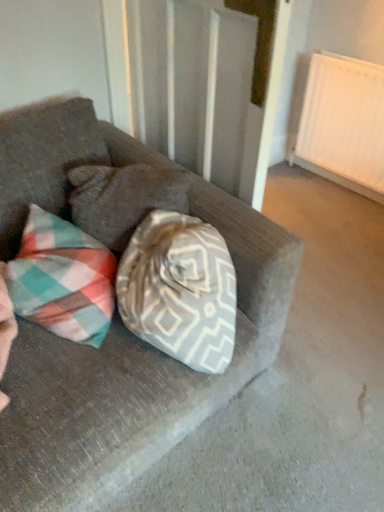
Question: Is suede couch at center bigger than plaid fabric pillow at center?

Choices:
 (A) yes
 (B) no

Answer: (A)

Question: Is suede couch at center not inside plaid fabric pillow at center?

Choices:
 (A) no
 (B) yes

Answer: (B)

Question: Is plaid fabric pillow at center a part of suede couch at center?

Choices:
 (A) yes
 (B) no

Answer: (A)

Question: Does suede couch at center turn towards plaid fabric pillow at center?

Choices:
 (A) yes
 (B) no

Answer: (B)

Question: Can you confirm if suede couch at center is positioned to the right of plaid fabric pillow at center?

Choices:
 (A) yes
 (B) no

Answer: (B)

Question: From the image's perspective, would you say suede couch at center is positioned over plaid fabric pillow at center?

Choices:
 (A) yes
 (B) no

Answer: (B)

Question: Can you confirm if white textured curtain at upper center is wider than white matte radiator at upper right?

Choices:
 (A) yes
 (B) no

Answer: (A)

Question: From the image's perspective, would you say white textured curtain at upper center is positioned over white matte radiator at upper right?

Choices:
 (A) no
 (B) yes

Answer: (A)

Question: From the image's perspective, is white textured curtain at upper center located beneath white matte radiator at upper right?

Choices:
 (A) no
 (B) yes

Answer: (B)

Question: From a real-world perspective, is white textured curtain at upper center under white matte radiator at upper right?

Choices:
 (A) yes
 (B) no

Answer: (B)

Question: Are white textured curtain at upper center and white matte radiator at upper right making contact?

Choices:
 (A) yes
 (B) no

Answer: (B)

Question: Can you confirm if white textured curtain at upper center is thinner than white matte radiator at upper right?

Choices:
 (A) no
 (B) yes

Answer: (A)

Question: Does plaid fabric pillow at center lie in front of suede couch at center?

Choices:
 (A) no
 (B) yes

Answer: (A)